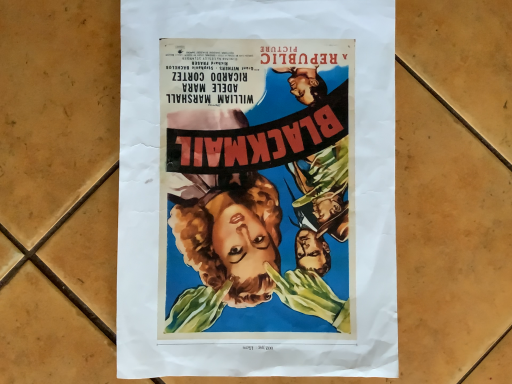
Describe the element at coordinates (257, 189) in the screenshot. This screenshot has width=512, height=384. I see `matte paper poster at center` at that location.

At what (x,y) coordinates should I click in order to perform the action: click on matte paper poster at center. Please return your answer as a coordinate pair (x, y). The height and width of the screenshot is (384, 512). Looking at the image, I should click on (257, 189).

At what (x,y) coordinates should I click in order to perform the action: click on matte paper poster at center. Please return your answer as a coordinate pair (x, y). The width and height of the screenshot is (512, 384). Looking at the image, I should click on click(257, 189).